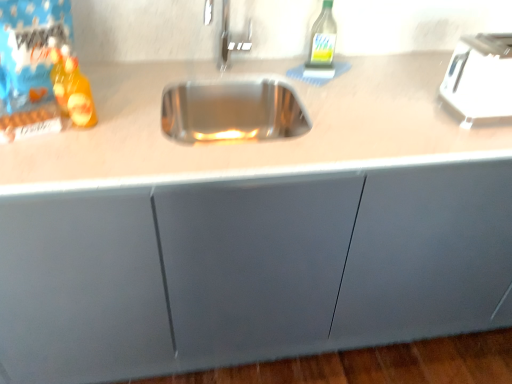
Find the location of a particular element. The width and height of the screenshot is (512, 384). vacant space in front of white plastic toaster at upper right is located at coordinates (479, 142).